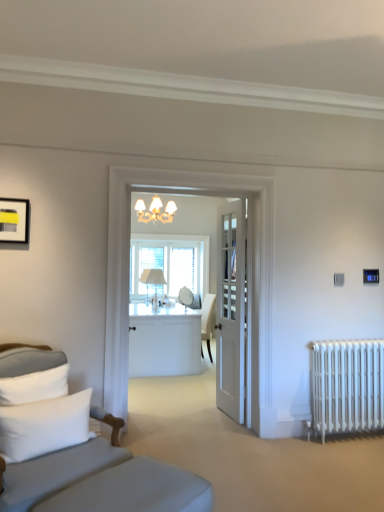
Question: Does white metal radiator at lower right have a greater height compared to gray fabric studio couch at left?

Choices:
 (A) yes
 (B) no

Answer: (B)

Question: Are white metal radiator at lower right and gray fabric studio couch at left making contact?

Choices:
 (A) no
 (B) yes

Answer: (A)

Question: Can you confirm if white metal radiator at lower right is bigger than gray fabric studio couch at left?

Choices:
 (A) yes
 (B) no

Answer: (B)

Question: Considering the relative sizes of white metal radiator at lower right and gray fabric studio couch at left in the image provided, is white metal radiator at lower right shorter than gray fabric studio couch at left?

Choices:
 (A) yes
 (B) no

Answer: (A)

Question: Can you confirm if white metal radiator at lower right is smaller than gray fabric studio couch at left?

Choices:
 (A) yes
 (B) no

Answer: (A)

Question: Does point (165, 236) appear closer or farther from the camera than point (28, 214)?

Choices:
 (A) closer
 (B) farther

Answer: (B)

Question: From a real-world perspective, relative to matte black picture frame at upper left, is clear glass window at center vertically above or below?

Choices:
 (A) below
 (B) above

Answer: (A)

Question: From the image's perspective, is clear glass window at center above or below matte black picture frame at upper left?

Choices:
 (A) above
 (B) below

Answer: (B)

Question: In terms of height, does clear glass window at center look taller or shorter compared to matte black picture frame at upper left?

Choices:
 (A) short
 (B) tall

Answer: (B)

Question: From a real-world perspective, is white fabric table lamp at center positioned above or below white wooden door at center?

Choices:
 (A) below
 (B) above

Answer: (B)

Question: From their relative heights in the image, would you say white fabric table lamp at center is taller or shorter than white wooden door at center?

Choices:
 (A) tall
 (B) short

Answer: (B)

Question: Does point (155, 289) appear closer or farther from the camera than point (240, 365)?

Choices:
 (A) closer
 (B) farther

Answer: (B)

Question: In terms of size, does white fabric table lamp at center appear bigger or smaller than white wooden door at center?

Choices:
 (A) big
 (B) small

Answer: (A)

Question: Would you say white glossy desk at center is to the left or to the right of clear glass window at center in the picture?

Choices:
 (A) left
 (B) right

Answer: (A)

Question: Based on their sizes in the image, would you say white glossy desk at center is bigger or smaller than clear glass window at center?

Choices:
 (A) big
 (B) small

Answer: (A)